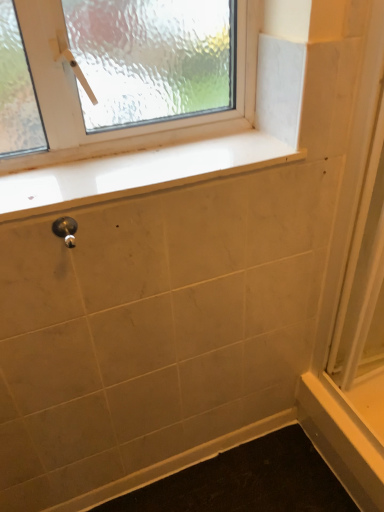
Question: Would you say white glossy window sill at upper center is outside white glossy screen door at right?

Choices:
 (A) no
 (B) yes

Answer: (B)

Question: Is white glossy window sill at upper center positioned behind white glossy screen door at right?

Choices:
 (A) no
 (B) yes

Answer: (B)

Question: From the image's perspective, is white glossy window sill at upper center below white glossy screen door at right?

Choices:
 (A) yes
 (B) no

Answer: (B)

Question: From a real-world perspective, is white glossy window sill at upper center physically above white glossy screen door at right?

Choices:
 (A) yes
 (B) no

Answer: (A)

Question: Is white glossy window sill at upper center not near white glossy screen door at right?

Choices:
 (A) no
 (B) yes

Answer: (A)

Question: In the image, is white glossy window sill at upper center positioned in front of or behind white glossy screen door at right?

Choices:
 (A) behind
 (B) front

Answer: (A)

Question: In terms of width, does white glossy window sill at upper center look wider or thinner when compared to white glossy screen door at right?

Choices:
 (A) thin
 (B) wide

Answer: (B)

Question: From the image's perspective, is white glossy window sill at upper center positioned above or below white glossy screen door at right?

Choices:
 (A) above
 (B) below

Answer: (A)

Question: Would you say white glossy window sill at upper center is to the left or to the right of white glossy screen door at right in the picture?

Choices:
 (A) left
 (B) right

Answer: (A)

Question: Is white glossy window sill at upper center spatially inside polished silver door handle at lower left, or outside of it?

Choices:
 (A) inside
 (B) outside

Answer: (B)

Question: In the image, is white glossy window sill at upper center positioned in front of or behind polished silver door handle at lower left?

Choices:
 (A) behind
 (B) front

Answer: (A)

Question: Is point (170, 166) closer or farther from the camera than point (74, 228)?

Choices:
 (A) closer
 (B) farther

Answer: (B)

Question: In terms of width, does white glossy window sill at upper center look wider or thinner when compared to polished silver door handle at lower left?

Choices:
 (A) thin
 (B) wide

Answer: (B)

Question: Do you think polished silver door handle at lower left is within white glossy screen door at right, or outside of it?

Choices:
 (A) inside
 (B) outside

Answer: (B)

Question: Visually, is polished silver door handle at lower left positioned to the left or to the right of white glossy screen door at right?

Choices:
 (A) right
 (B) left

Answer: (B)